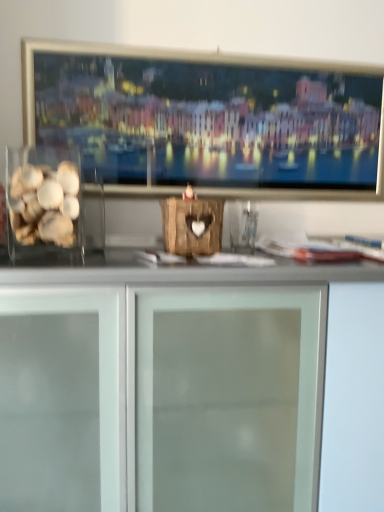
Question: Considering the relative sizes of translucent glass shells at left and frosted glass cabinet at center in the image provided, is translucent glass shells at left shorter than frosted glass cabinet at center?

Choices:
 (A) yes
 (B) no

Answer: (A)

Question: Could frosted glass cabinet at center be considered to be inside translucent glass shells at left?

Choices:
 (A) no
 (B) yes

Answer: (A)

Question: Considering the relative positions of translucent glass shells at left and frosted glass cabinet at center in the image provided, is translucent glass shells at left to the left of frosted glass cabinet at center from the viewer's perspective?

Choices:
 (A) yes
 (B) no

Answer: (A)

Question: Is translucent glass shells at left positioned in front of frosted glass cabinet at center?

Choices:
 (A) no
 (B) yes

Answer: (A)

Question: From a real-world perspective, is translucent glass shells at left over frosted glass cabinet at center?

Choices:
 (A) no
 (B) yes

Answer: (B)

Question: Does translucent glass shells at left come behind frosted glass cabinet at center?

Choices:
 (A) yes
 (B) no

Answer: (A)

Question: From the image's perspective, is frosted glass cabinet at center beneath translucent glass shells at left?

Choices:
 (A) no
 (B) yes

Answer: (B)

Question: Does frosted glass cabinet at center turn towards translucent glass shells at left?

Choices:
 (A) yes
 (B) no

Answer: (B)

Question: Could translucent glass shells at left be considered to be inside frosted glass cabinet at center?

Choices:
 (A) yes
 (B) no

Answer: (B)

Question: From a real-world perspective, is frosted glass cabinet at center on translucent glass shells at left?

Choices:
 (A) yes
 (B) no

Answer: (B)

Question: Does frosted glass cabinet at center have a greater height compared to translucent glass shells at left?

Choices:
 (A) no
 (B) yes

Answer: (B)

Question: Considering the relative positions of frosted glass cabinet at center and translucent glass shells at left in the image provided, is frosted glass cabinet at center behind translucent glass shells at left?

Choices:
 (A) no
 (B) yes

Answer: (A)

Question: From the image's perspective, is translucent glass shells at left positioned above or below frosted glass cabinet at center?

Choices:
 (A) below
 (B) above

Answer: (B)